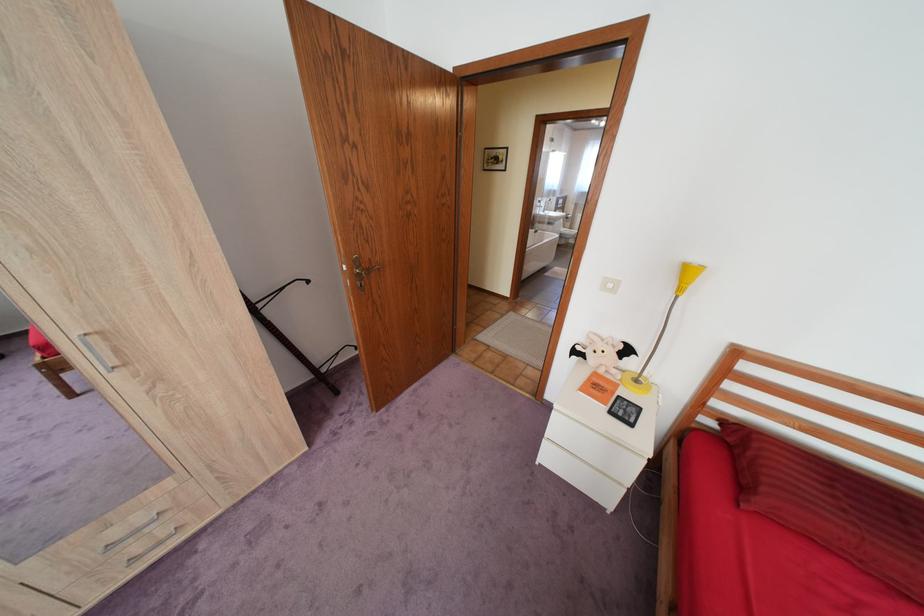
I want to click on brass door handle, so coord(360,273).